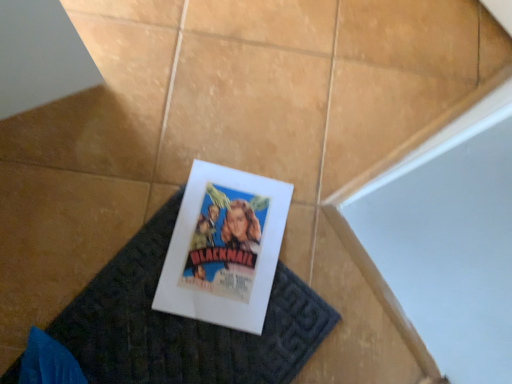
Question: From the image's perspective, is dark gray textured doormat at center positioned above or below matte paper poster at center?

Choices:
 (A) below
 (B) above

Answer: (A)

Question: Is point (98, 382) closer or farther from the camera than point (238, 231)?

Choices:
 (A) closer
 (B) farther

Answer: (A)

Question: From a real-world perspective, is dark gray textured doormat at center positioned above or below matte paper poster at center?

Choices:
 (A) below
 (B) above

Answer: (A)

Question: In terms of width, does matte paper poster at center look wider or thinner when compared to dark gray textured doormat at center?

Choices:
 (A) thin
 (B) wide

Answer: (A)

Question: Based on their positions, is matte paper poster at center located to the left or right of dark gray textured doormat at center?

Choices:
 (A) right
 (B) left

Answer: (A)

Question: Considering the positions of matte paper poster at center and dark gray textured doormat at center in the image, is matte paper poster at center bigger or smaller than dark gray textured doormat at center?

Choices:
 (A) small
 (B) big

Answer: (A)

Question: Choose the correct answer: Is matte paper poster at center inside dark gray textured doormat at center or outside it?

Choices:
 (A) inside
 (B) outside

Answer: (A)